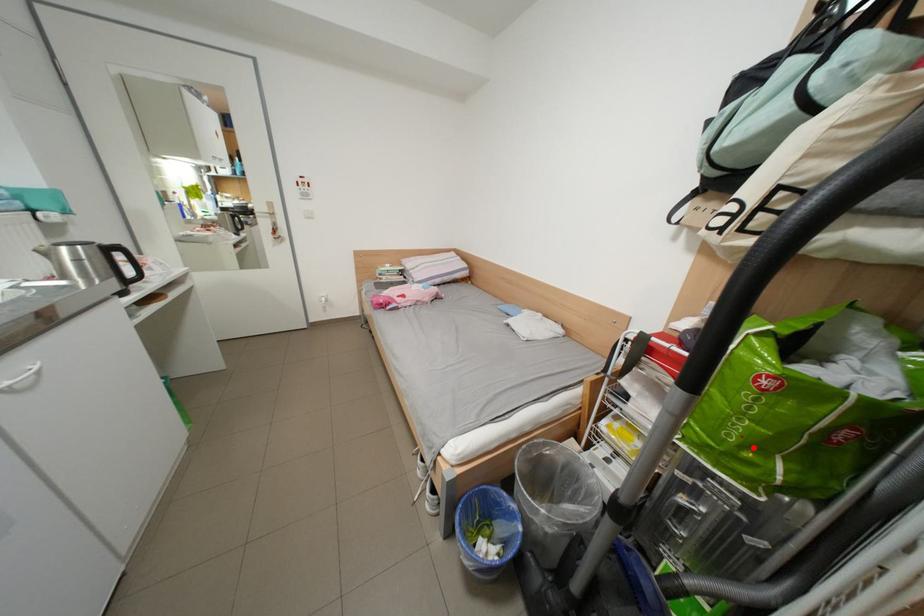
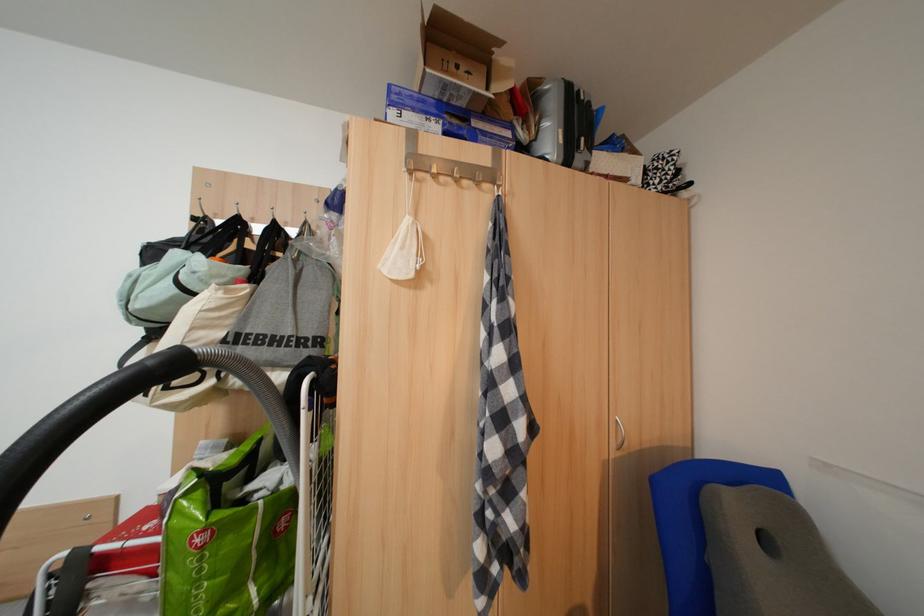
Locate, in the second image, the point that corresponds to the highlighted location in the first image.

(225, 610)